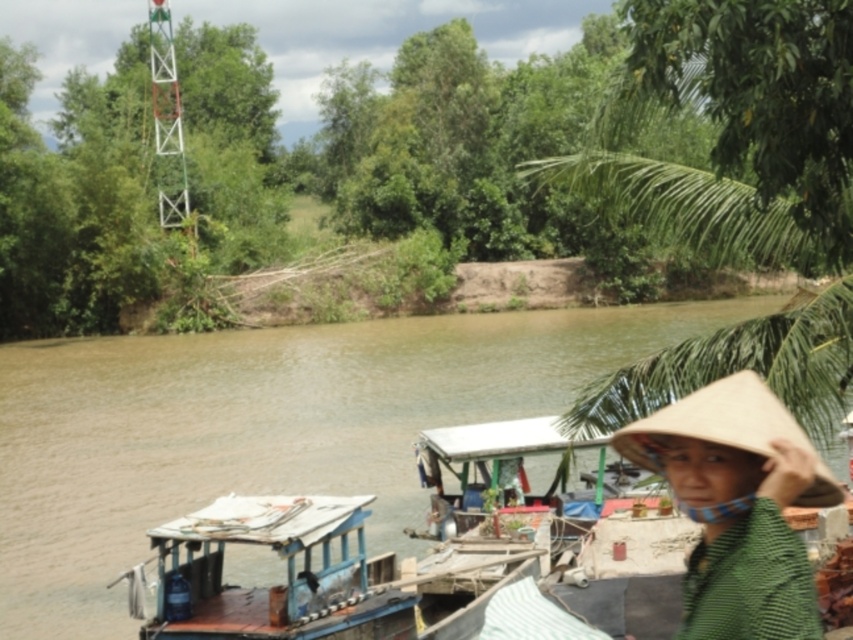
Does wooden boat at center appear under bleached straw hat at lower right?

Yes, wooden boat at center is below bleached straw hat at lower right.

Which is more to the right, wooden boat at center or bleached straw hat at lower right?

Positioned to the right is bleached straw hat at lower right.

You are a GUI agent. You are given a task and a screenshot of the screen. Output one action in this format:
    pyautogui.click(x=<x>, y=<y>)
    Task: Click on the wooden boat at center
    
    Given the screenshot: What is the action you would take?
    pyautogui.click(x=264, y=586)

Does brown muddy water at center have a smaller size compared to wooden boat at center?

Incorrect, brown muddy water at center is not smaller in size than wooden boat at center.

Can you confirm if brown muddy water at center is positioned to the right of wooden boat at center?

Incorrect, brown muddy water at center is not on the right side of wooden boat at center.

The image size is (853, 640). Identify the location of brown muddy water at center. (265, 428).

Between brown muddy water at center and bleached straw hat at lower right, which one appears on the right side from the viewer's perspective?

bleached straw hat at lower right

Which is below, brown muddy water at center or bleached straw hat at lower right?

bleached straw hat at lower right

What do you see at coordinates (265, 428) in the screenshot?
I see `brown muddy water at center` at bounding box center [265, 428].

Identify the location of brown muddy water at center. (265, 428).